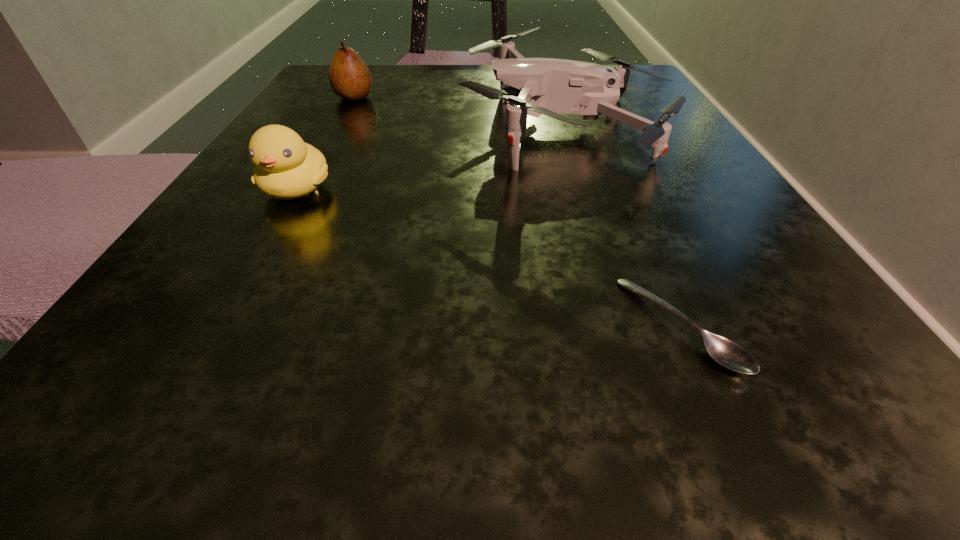
Find the location of a particular element. Image resolution: width=960 pixels, height=540 pixels. free space located on the back of the shortest object is located at coordinates (613, 174).

The image size is (960, 540). Find the location of `pear that is at the far edge`. pear that is at the far edge is located at coordinates (350, 78).

Image resolution: width=960 pixels, height=540 pixels. I want to click on drone at the far edge, so click(x=528, y=86).

You are a GUI agent. You are given a task and a screenshot of the screen. Output one action in this format:
    pyautogui.click(x=<x>, y=<y>)
    Task: Click on the object located at the near edge
    
    Given the screenshot: What is the action you would take?
    pyautogui.click(x=725, y=352)

I want to click on pear positioned at the left edge, so click(x=350, y=78).

Where is `duckling that is at the left edge`? duckling that is at the left edge is located at coordinates (286, 167).

This screenshot has height=540, width=960. In order to click on drone that is at the right edge in this screenshot , I will do [x=528, y=86].

This screenshot has width=960, height=540. I want to click on soupspoon present at the right edge, so click(x=725, y=352).

This screenshot has height=540, width=960. What are the coordinates of `object located in the far left corner section of the desktop` in the screenshot? It's located at (350, 78).

In order to click on object situated at the far right corner in this screenshot , I will do [528, 86].